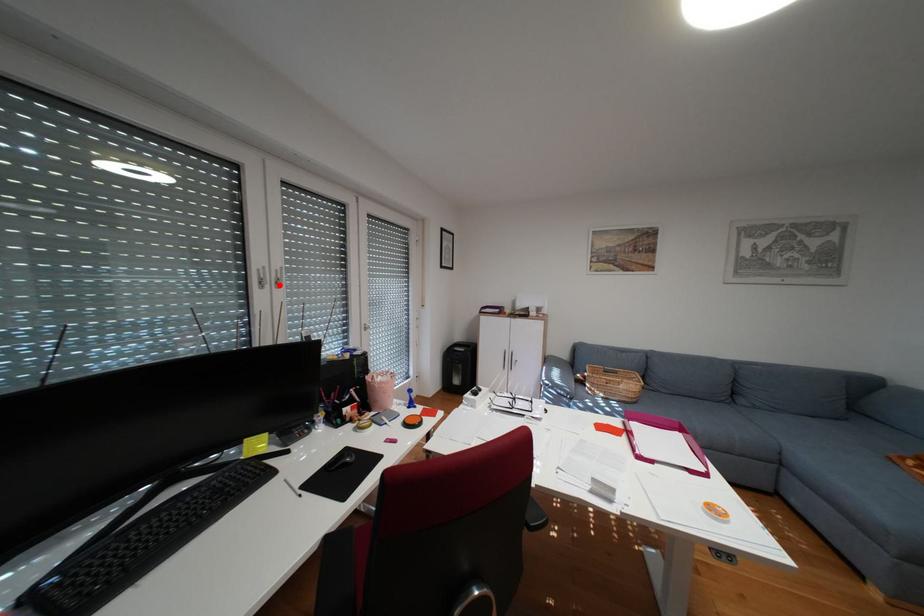
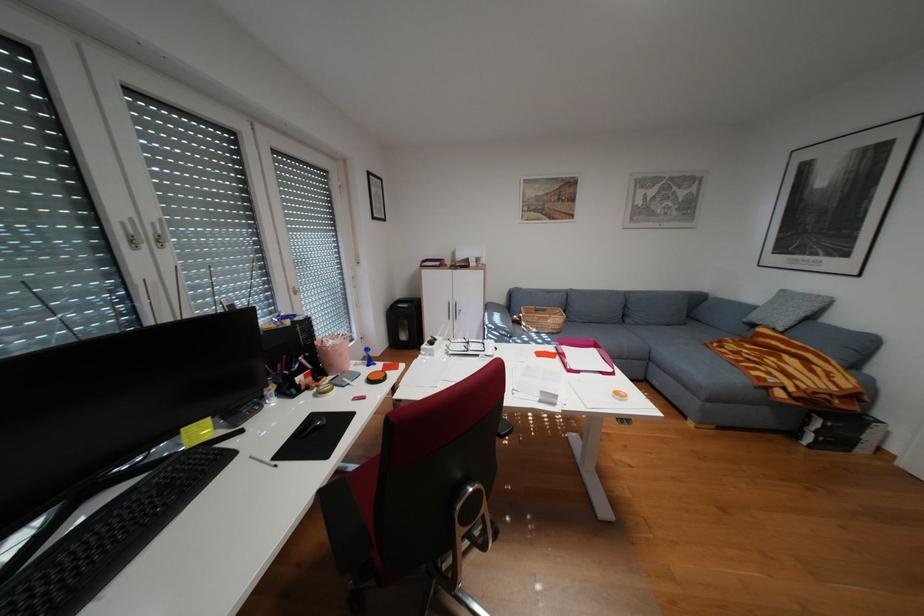
The point at the highlighted location is marked in the first image. Where is the corresponding point in the second image?

(156, 245)